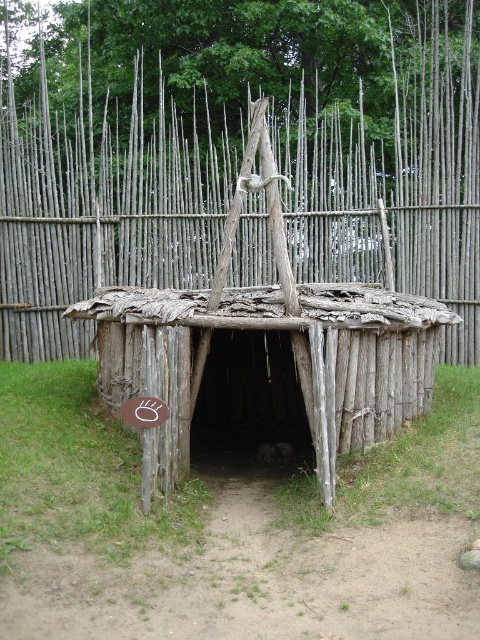
Question: Does gray wooden fence at center have a lesser width compared to weathered wood hut at center?

Choices:
 (A) no
 (B) yes

Answer: (A)

Question: Estimate the real-world distances between objects in this image. Which object is farther from the weathered wood hut at center?

Choices:
 (A) gray wooden fence at center
 (B) green grass at center

Answer: (A)

Question: Which of these objects is positioned farthest from the green grass at center?

Choices:
 (A) weathered wood hut at center
 (B) gray wooden fence at center

Answer: (B)

Question: Which point is farther from the camera taking this photo?

Choices:
 (A) (362, 272)
 (B) (375, 346)
 (C) (92, 621)

Answer: (A)

Question: Can you confirm if gray wooden fence at center is thinner than weathered wood hut at center?

Choices:
 (A) yes
 (B) no

Answer: (B)

Question: Does green grass at center have a smaller size compared to gray wooden fence at center?

Choices:
 (A) no
 (B) yes

Answer: (B)